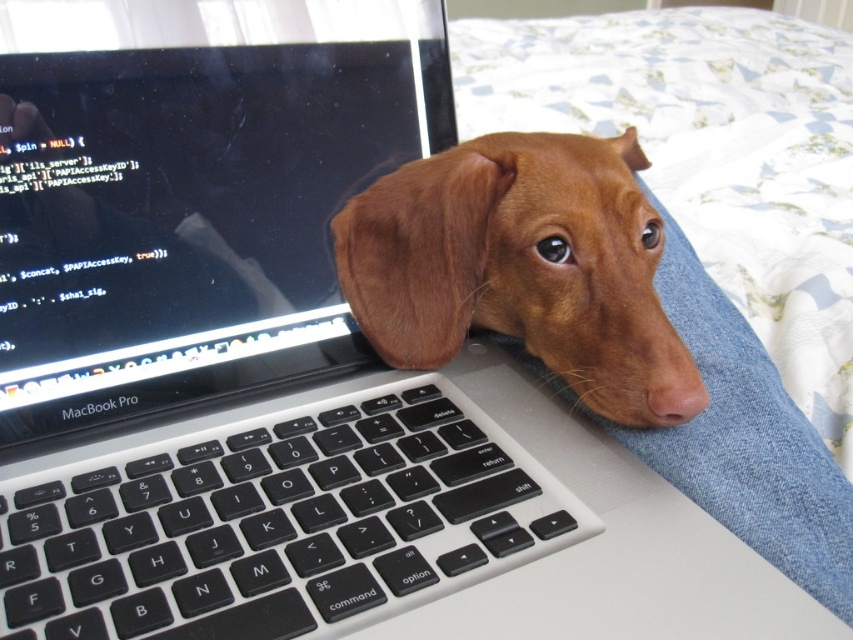
Between black glossy screen at upper left and pink matte/natural nose at center, which one appears on the right side from the viewer's perspective?

From the viewer's perspective, pink matte/natural nose at center appears more on the right side.

What do you see at coordinates (190, 192) in the screenshot? I see `black glossy screen at upper left` at bounding box center [190, 192].

Does point (107, 134) lie behind point (683, 413)?

Yes, it is.

I want to click on black glossy screen at upper left, so click(190, 192).

Which is more to the left, black matte keyboard at center or brown fur dog at center?

black matte keyboard at center is more to the left.

Is point (340, 636) closer to viewer compared to point (370, 244)?

Yes, point (340, 636) is closer to viewer.

Locate an element on the screen. black matte keyboard at center is located at coordinates (276, 520).

At what (x,y) coordinates should I click in order to perform the action: click on black glossy screen at upper left. Please return your answer as a coordinate pair (x, y). The image size is (853, 640). Looking at the image, I should click on [x=190, y=192].

Is point (149, 388) positioned before point (622, 356)?

No, it is behind (622, 356).

At what (x,y) coordinates should I click in order to perform the action: click on black glossy screen at upper left. Please return your answer as a coordinate pair (x, y). Looking at the image, I should click on (190, 192).